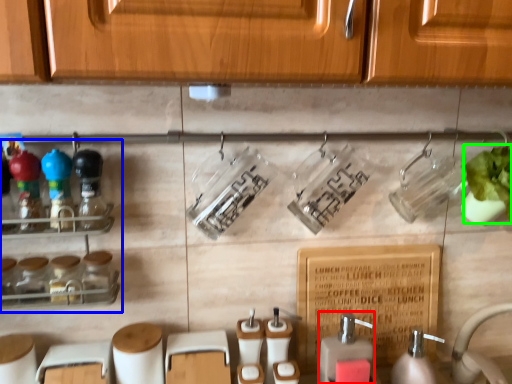
Question: Which object is positioned closest to soap dispenser (highlighted by a red box)? Select from shelf (highlighted by a blue box) and plant (highlighted by a green box).

Choices:
 (A) shelf
 (B) plant

Answer: (B)